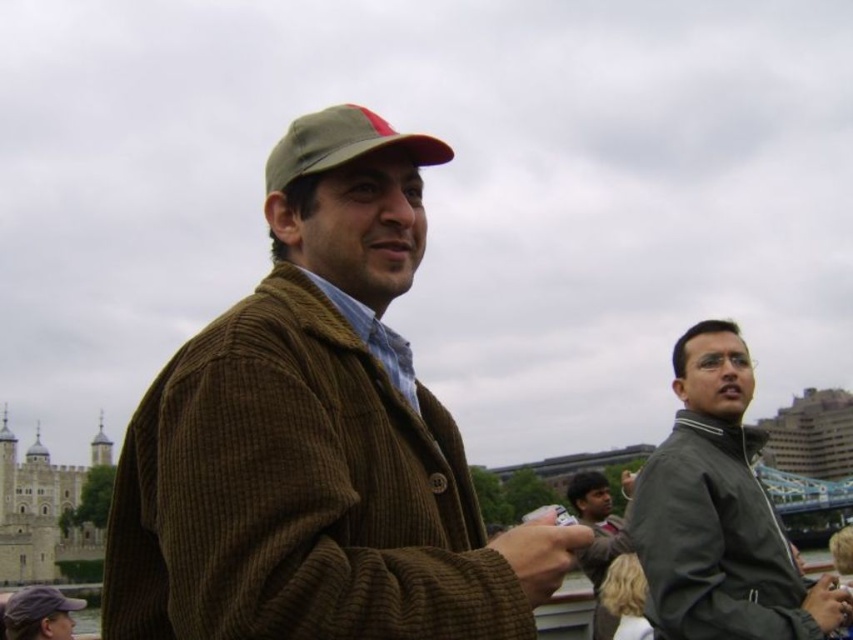
The height and width of the screenshot is (640, 853). I want to click on matte brown cap at center, so click(38, 612).

Is matte brown cap at center below matte black hand at lower right?

Yes, matte brown cap at center is below matte black hand at lower right.

Is point (70, 627) farther from viewer compared to point (836, 611)?

That is True.

Where is `matte brown cap at center`? matte brown cap at center is located at coordinates 38,612.

Can you confirm if green corduroy baseball cap at center is positioned below matte brown cap at center?

No, green corduroy baseball cap at center is not below matte brown cap at center.

Is green corduroy baseball cap at center to the left of matte brown cap at center from the viewer's perspective?

In fact, green corduroy baseball cap at center is to the right of matte brown cap at center.

Is point (357, 154) positioned before point (48, 624)?

Yes, it is.

Find the location of `green corduroy baseball cap at center`. green corduroy baseball cap at center is located at coordinates (341, 145).

Between brown corduroy jacket at center and matte black hand at lower right, which one appears on the left side from the viewer's perspective?

brown corduroy jacket at center

Does brown corduroy jacket at center have a lesser width compared to matte black hand at lower right?

In fact, brown corduroy jacket at center might be wider than matte black hand at lower right.

Where is `brown corduroy jacket at center`? This screenshot has width=853, height=640. brown corduroy jacket at center is located at coordinates (308, 435).

The image size is (853, 640). I want to click on brown corduroy jacket at center, so click(308, 435).